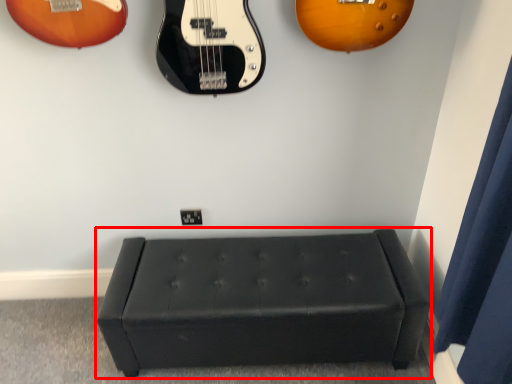
Question: Considering the relative positions of furniture (annotated by the red box) and curtain in the image provided, where is furniture (annotated by the red box) located with respect to the staircase?

Choices:
 (A) left
 (B) right

Answer: (A)